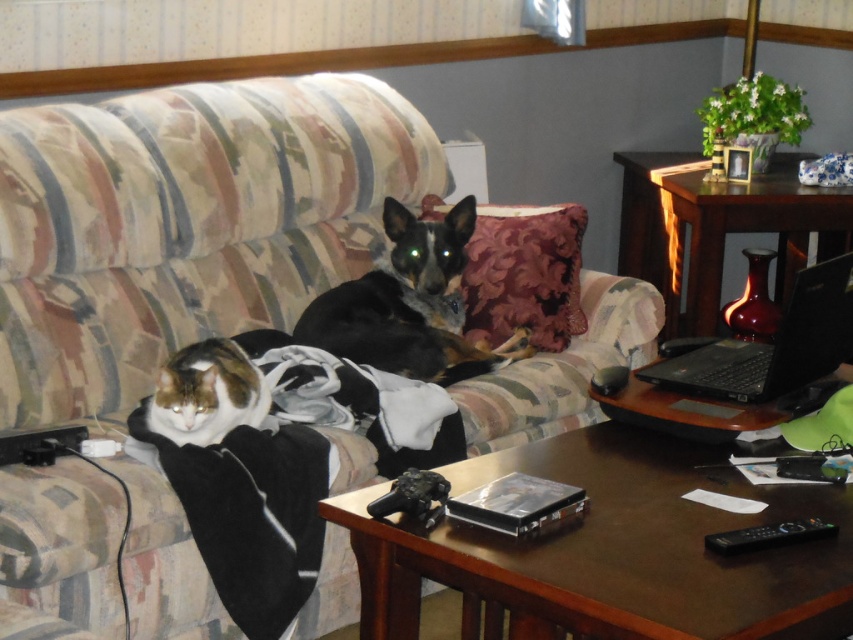
Question: Observing the image, what is the correct spatial positioning of black fleece blanket at lower left in reference to velvet-like burgundy pillow at center?

Choices:
 (A) left
 (B) right

Answer: (A)

Question: Does black fur dog at center appear on the right side of fluffy white cat at lower left?

Choices:
 (A) yes
 (B) no

Answer: (A)

Question: Which point is farther from the camera taking this photo?

Choices:
 (A) (532, 323)
 (B) (625, 248)
 (C) (651, 380)
 (D) (177, 396)

Answer: (B)

Question: Which point is closer to the camera taking this photo?

Choices:
 (A) (438, 304)
 (B) (833, 561)
 (C) (280, 296)
 (D) (808, 298)

Answer: (B)

Question: Is wooden table at right wider than velvet-like burgundy pillow at center?

Choices:
 (A) yes
 (B) no

Answer: (A)

Question: Considering the real-world distances, which object is closest to the velvet-like burgundy pillow at center?

Choices:
 (A) wooden table at lower center
 (B) wooden table at right

Answer: (B)